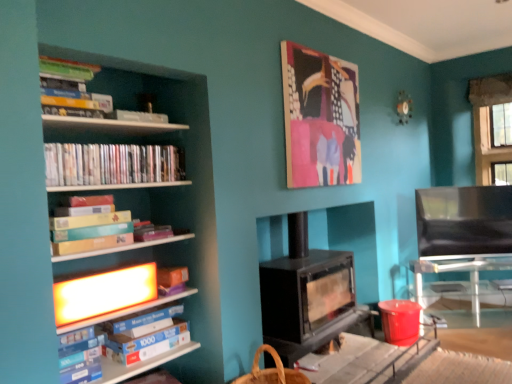
Question: Is black leather armchair at right far away from matte plastic dvds at left, which ranks as the 1th book in top-to-bottom order?

Choices:
 (A) no
 (B) yes

Answer: (B)

Question: Considering the relative positions of black leather armchair at right and matte plastic dvds at left, which ranks as the 1th book in top-to-bottom order, in the image provided, is black leather armchair at right to the left of matte plastic dvds at left, which ranks as the 1th book in top-to-bottom order, from the viewer's perspective?

Choices:
 (A) yes
 (B) no

Answer: (B)

Question: Is black leather armchair at right in contact with matte plastic dvds at left, which ranks as the 1th book in top-to-bottom order?

Choices:
 (A) yes
 (B) no

Answer: (B)

Question: Could you tell me if black leather armchair at right is facing matte plastic dvds at left, which ranks as the 1th book in top-to-bottom order?

Choices:
 (A) no
 (B) yes

Answer: (A)

Question: Does black leather armchair at right have a larger size compared to matte plastic dvds at left, which ranks as the 1th book in top-to-bottom order?

Choices:
 (A) no
 (B) yes

Answer: (B)

Question: From a real-world perspective, is black matte wood burning stove at center physically located above or below canvas painting at upper center?

Choices:
 (A) below
 (B) above

Answer: (A)

Question: Is black matte wood burning stove at center wider or thinner than canvas painting at upper center?

Choices:
 (A) thin
 (B) wide

Answer: (B)

Question: Based on their sizes in the image, would you say black matte wood burning stove at center is bigger or smaller than canvas painting at upper center?

Choices:
 (A) big
 (B) small

Answer: (A)

Question: Is black matte wood burning stove at center inside the boundaries of canvas painting at upper center, or outside?

Choices:
 (A) inside
 (B) outside

Answer: (B)

Question: From a real-world perspective, is matte cardboard book at left, which is counted as the second book, starting from the bottom, positioned above or below blue cardboard box at left, the 3th book from the top?

Choices:
 (A) below
 (B) above

Answer: (B)

Question: Looking at the image, does matte cardboard book at left, which is counted as the second book, starting from the top, seem bigger or smaller compared to blue cardboard box at left, the 3th book from the top?

Choices:
 (A) big
 (B) small

Answer: (A)

Question: In terms of width, does matte cardboard book at left, which is counted as the second book, starting from the bottom, look wider or thinner when compared to blue cardboard box at left, the 3th book from the top?

Choices:
 (A) thin
 (B) wide

Answer: (B)

Question: In terms of height, does matte cardboard book at left, which is counted as the second book, starting from the top, look taller or shorter compared to blue cardboard box at left, the 3th book from the top?

Choices:
 (A) tall
 (B) short

Answer: (B)

Question: From a real-world perspective, is canvas painting at upper center above or below black matte wood burning stove at center?

Choices:
 (A) above
 (B) below

Answer: (A)

Question: Relative to black matte wood burning stove at center, is canvas painting at upper center in front or behind?

Choices:
 (A) front
 (B) behind

Answer: (B)